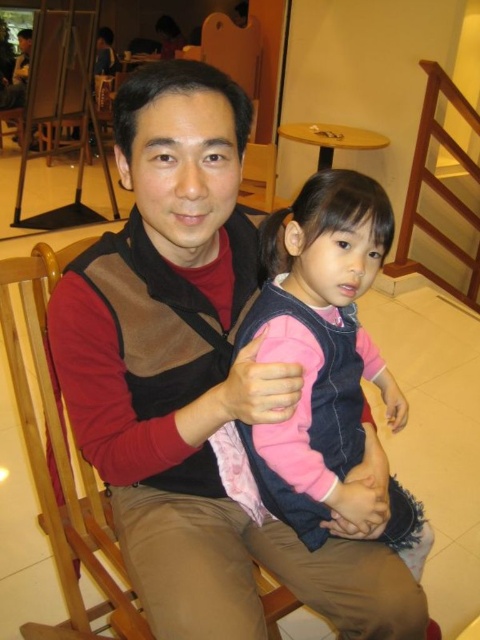
Question: Observing the image, what is the correct spatial positioning of brown suede vest at center in reference to pink fleece vest at center?

Choices:
 (A) below
 (B) above

Answer: (B)

Question: In this image, where is brown suede vest at center located relative to pink fleece vest at center?

Choices:
 (A) above
 (B) below

Answer: (A)

Question: Does brown suede vest at center come in front of pink fleece vest at center?

Choices:
 (A) no
 (B) yes

Answer: (B)

Question: Which of the following is the farthest from the observer?

Choices:
 (A) brown suede vest at center
 (B) pink fleece vest at center

Answer: (B)